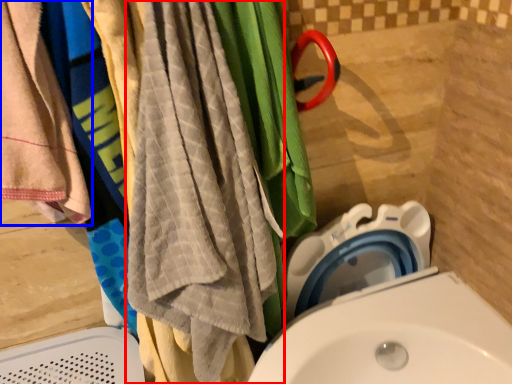
Question: Which of the following is the closest to the observer, beach towel (highlighted by a red box) or towel (highlighted by a blue box)?

Choices:
 (A) beach towel
 (B) towel

Answer: (A)